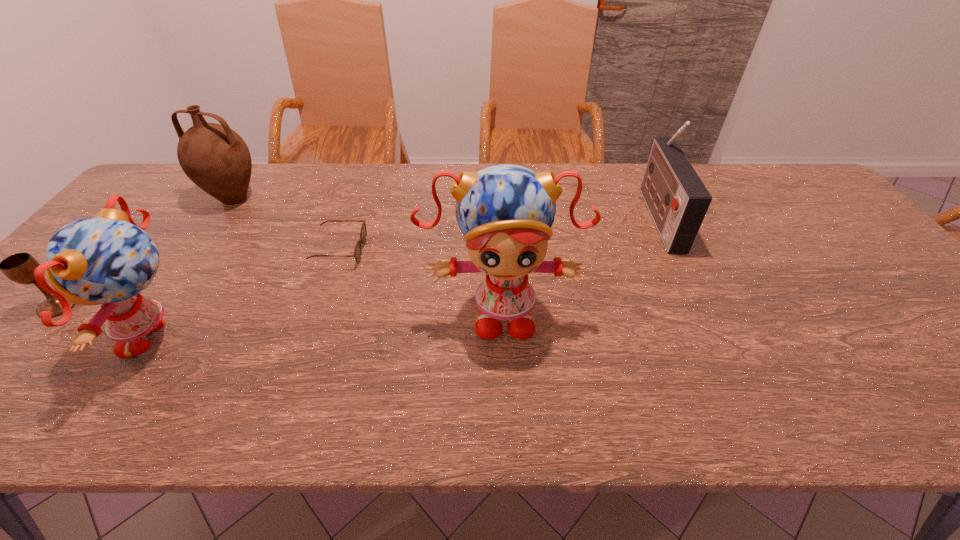
You are a GUI agent. You are given a task and a screenshot of the screen. Output one action in this format:
    pyautogui.click(x=<x>, y=<y>)
    Task: Click on the shorter doll
    
    Given the screenshot: What is the action you would take?
    pyautogui.click(x=108, y=259)

This screenshot has width=960, height=540. I want to click on the tallest object, so click(505, 212).

The image size is (960, 540). What are the coordinates of `the right doll` in the screenshot? It's located at pos(505,212).

You are a GUI agent. You are given a task and a screenshot of the screen. Output one action in this format:
    pyautogui.click(x=<x>, y=<y>)
    Task: Click on the radio receiver
    
    Given the screenshot: What is the action you would take?
    pyautogui.click(x=677, y=199)

At what (x,y) coordinates should I click in order to perform the action: click on the shortest object. Please return your answer as a coordinate pair (x, y). The width and height of the screenshot is (960, 540). Looking at the image, I should click on (363, 234).

This screenshot has width=960, height=540. I want to click on the third object from right to left, so click(363, 234).

I want to click on pitcher, so click(x=214, y=157).

The height and width of the screenshot is (540, 960). I want to click on the second shortest object, so click(19, 267).

This screenshot has height=540, width=960. In order to click on the leftmost object in this screenshot , I will do `click(19, 267)`.

Identify the location of blank space located on the face of the shorter doll. (70, 337).